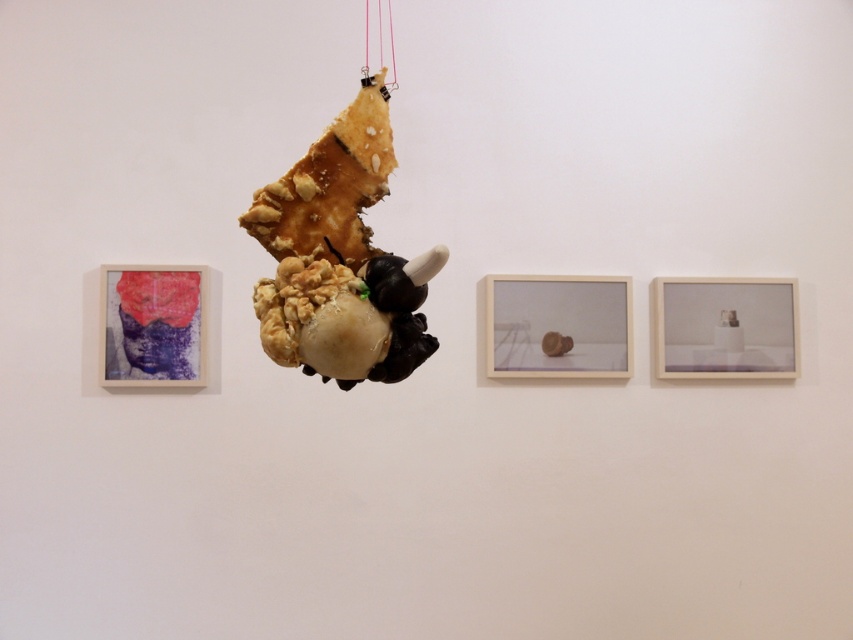
Question: Can you confirm if golden-brown crumbly pastry at center is positioned to the left of spongy chocolate cake at center?

Choices:
 (A) no
 (B) yes

Answer: (B)

Question: Which point appears farthest from the camera in this image?

Choices:
 (A) 280,225
 (B) 192,301

Answer: (B)

Question: Does spongy chocolate cake at center lie behind textured fabric mask at left?

Choices:
 (A) no
 (B) yes

Answer: (A)

Question: Which is farther from the spongy chocolate cake at center?

Choices:
 (A) textured fabric mask at left
 (B) golden-brown crumbly pastry at center

Answer: (A)

Question: Which point appears farthest from the camera in this image?

Choices:
 (A) (392, 320)
 (B) (386, 186)
 (C) (160, 330)

Answer: (C)

Question: Considering the relative positions of spongy chocolate cake at center and textured fabric mask at left in the image provided, where is spongy chocolate cake at center located with respect to textured fabric mask at left?

Choices:
 (A) above
 (B) below

Answer: (A)